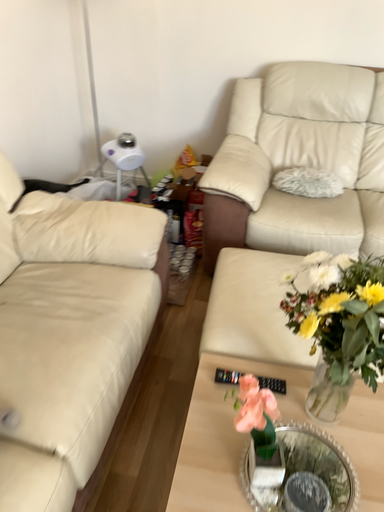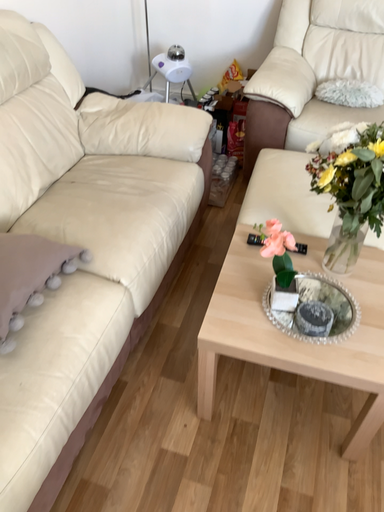
Question: Which way did the camera rotate in the video?

Choices:
 (A) rotated upward
 (B) rotated downward

Answer: (B)